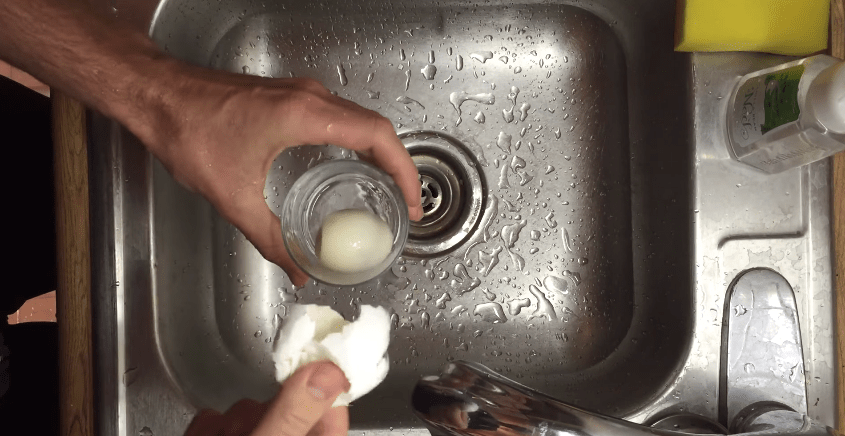
I want to click on sink faucet, so click(x=542, y=422).